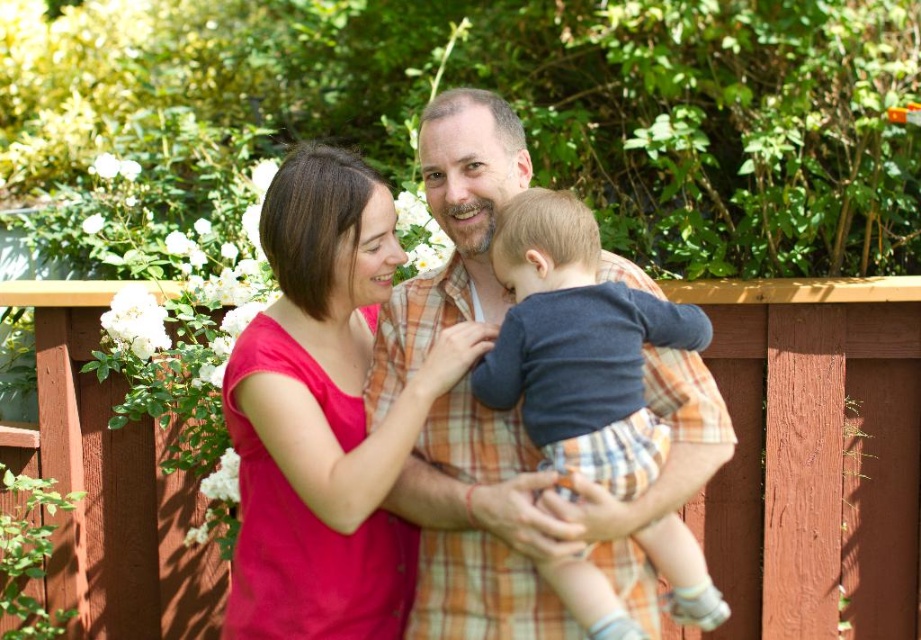
Does wooden fence at center appear on the left side of matte orange plaid shirt at center?

In fact, wooden fence at center is to the right of matte orange plaid shirt at center.

Locate an element on the screen. The height and width of the screenshot is (640, 921). wooden fence at center is located at coordinates (815, 456).

Is point (187, 516) positioned in front of point (561, 515)?

No, it is not.

In order to click on wooden fence at center in this screenshot , I will do point(815,456).

Which is below, wooden fence at center or matte pink shirt at center?

Positioned lower is wooden fence at center.

Can you confirm if wooden fence at center is positioned to the left of matte pink shirt at center?

Incorrect, wooden fence at center is not on the left side of matte pink shirt at center.

Is point (863, 484) in front of point (335, 340)?

That is False.

At what (x,y) coordinates should I click in order to perform the action: click on wooden fence at center. Please return your answer as a coordinate pair (x, y). The width and height of the screenshot is (921, 640). Looking at the image, I should click on (815, 456).

Can you confirm if matte pink shirt at center is taller than matte orange plaid shirt at center?

No.

Looking at this image, who is higher up, matte pink shirt at center or matte orange plaid shirt at center?

matte orange plaid shirt at center is higher up.

Is point (358, 406) farther from camera compared to point (495, 570)?

Yes.

Where is `matte pink shirt at center`? The image size is (921, 640). matte pink shirt at center is located at coordinates (325, 413).